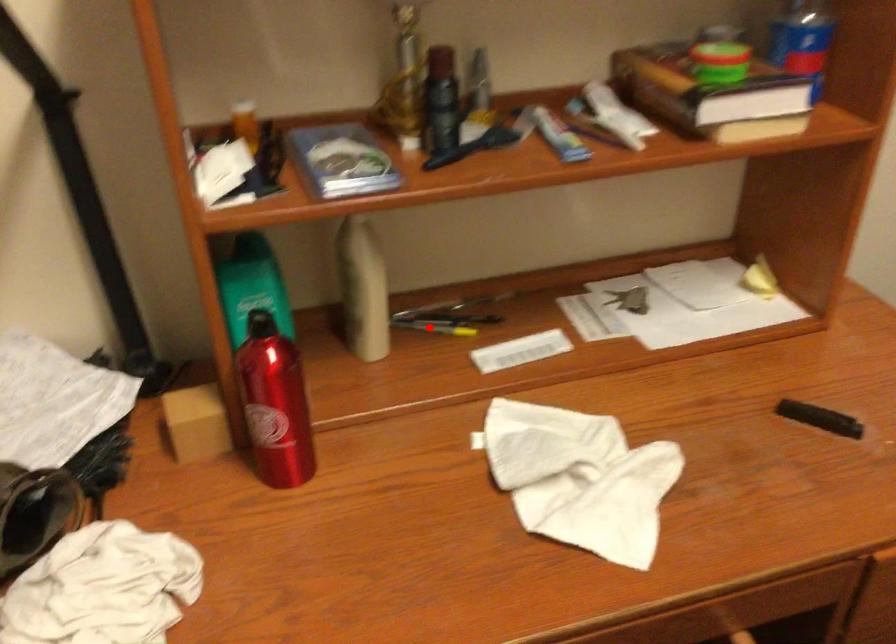
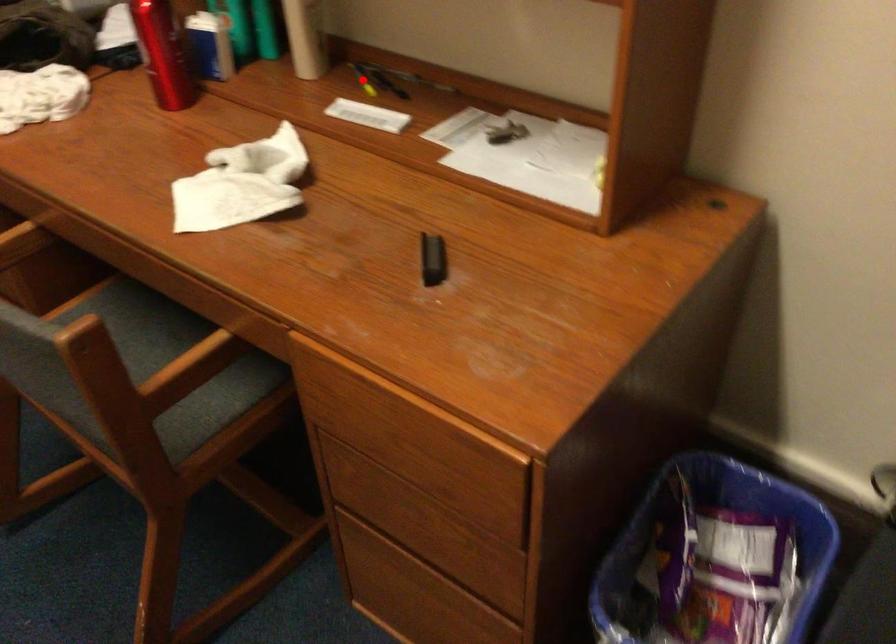
I am providing you with two images of the same scene from different viewpoints. A red point is marked on the first image and another point is marked on the second image. Are the points marked in image1 and image2 representing the same 3D position?

Yes